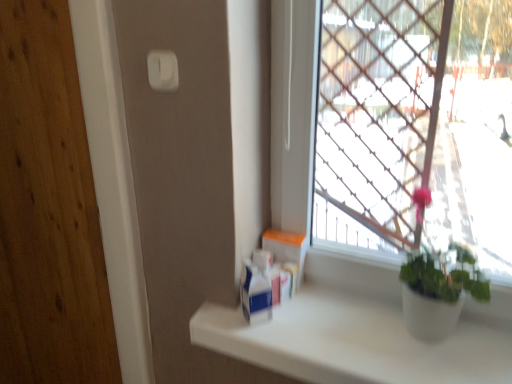
At what (x,y) coordinates should I click in order to perform the action: click on free space to the right of white cardboard box at center. Please return your answer as a coordinate pair (x, y). The width and height of the screenshot is (512, 384). Looking at the image, I should click on (343, 303).